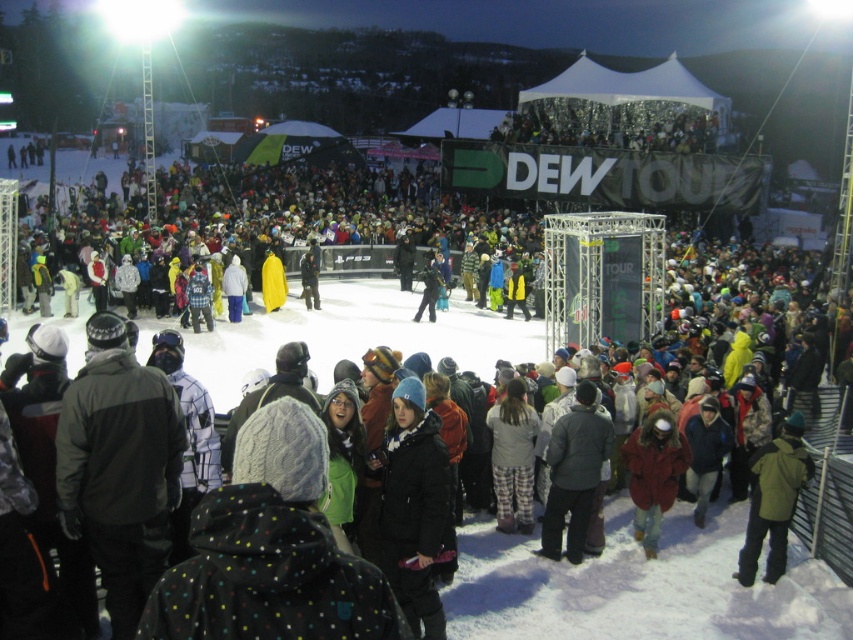
Question: Can you confirm if black matte jacket at center is positioned below dark gray jacket at center?

Choices:
 (A) no
 (B) yes

Answer: (B)

Question: Where is green matte jacket at lower right located in relation to red fur-lined coat at center in the image?

Choices:
 (A) above
 (B) below

Answer: (A)

Question: Which of these objects is positioned farthest from the black matte jacket at center?

Choices:
 (A) green matte jacket at lower right
 (B) red fur-lined coat at center

Answer: (A)

Question: Which point is farther to the camera?

Choices:
 (A) red fur-lined coat at center
 (B) dark gray jacket at center
 (C) green matte jacket at lower right

Answer: (A)

Question: Which is nearer to the red fur-lined coat at center?

Choices:
 (A) green matte jacket at lower right
 (B) dark gray jacket at center
 (C) black matte jacket at center

Answer: (B)

Question: Observing the image, what is the correct spatial positioning of black matte jacket at center in reference to green matte jacket at lower right?

Choices:
 (A) above
 (B) below

Answer: (A)